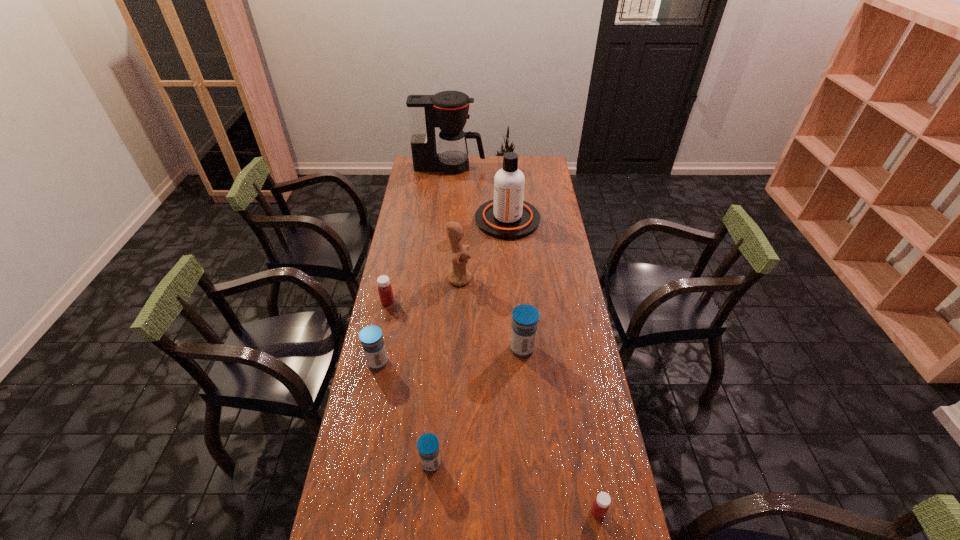
Where is `medicine that can be found as the third closest to the third farthest object`? This screenshot has height=540, width=960. medicine that can be found as the third closest to the third farthest object is located at coordinates (371, 337).

Locate which blue medicine is the third closest to the fifth nearest object. Please provide its 2D coordinates. Your answer should be formatted as a tuple, i.e. [(x, y)], where the tuple contains the x and y coordinates of a point satisfying the conditions above.

[(428, 444)]

Image resolution: width=960 pixels, height=540 pixels. In order to click on blue medicine that is the closest to the second blue medicine from left to right in this screenshot , I will do `click(371, 337)`.

Identify the location of vacant space that satisfies the following two spatial constraints: 1. pour from the carafe of the coffee maker; 2. on the back side of the smallest blue medicine. Image resolution: width=960 pixels, height=540 pixels. (421, 463).

Image resolution: width=960 pixels, height=540 pixels. Find the location of `vacant space that satisfies the following two spatial constraints: 1. on the front-facing side of the sixth shortest object; 2. on the front side of the second tallest medicine`. vacant space that satisfies the following two spatial constraints: 1. on the front-facing side of the sixth shortest object; 2. on the front side of the second tallest medicine is located at coordinates (456, 362).

Find the location of `vacant space that satisfies the following two spatial constraints: 1. on the front-facing side of the shortest object; 2. on the right side of the figurine`. vacant space that satisfies the following two spatial constraints: 1. on the front-facing side of the shortest object; 2. on the right side of the figurine is located at coordinates (448, 512).

Identify the location of vacant position in the image that satisfies the following two spatial constraints: 1. on the back side of the second tallest object; 2. on the right side of the nearest blue medicine. The height and width of the screenshot is (540, 960). (450, 219).